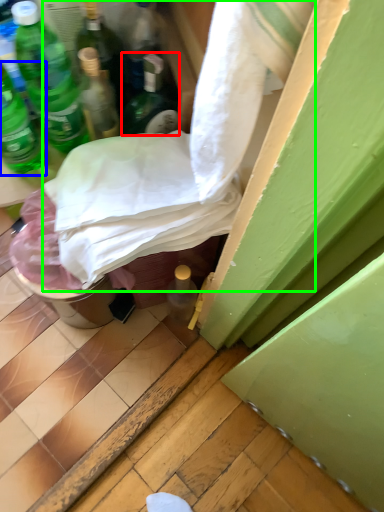
Question: Which object is positioned closest to bottle (highlighted by a red box)? Select from bottle (highlighted by a blue box) and sheet (highlighted by a green box).

Choices:
 (A) bottle
 (B) sheet

Answer: (B)